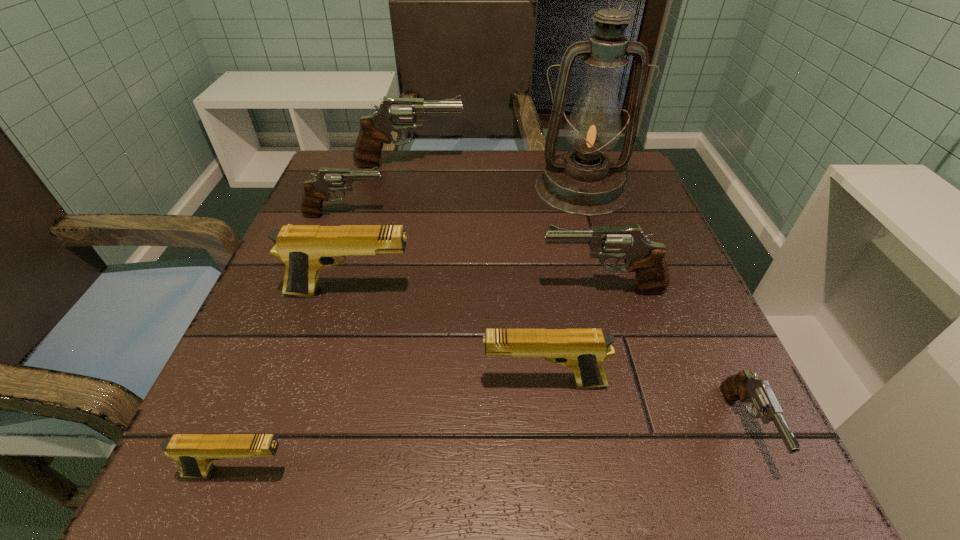
The image size is (960, 540). Find the location of `vacant space located at the barrel of the second biggest tan pistol`. vacant space located at the barrel of the second biggest tan pistol is located at coordinates (272, 383).

Where is `vacant area situated 0.270m at the barrel of the second biggest tan pistol`? vacant area situated 0.270m at the barrel of the second biggest tan pistol is located at coordinates (299, 383).

Image resolution: width=960 pixels, height=540 pixels. In order to click on free space located at the barrel of the second biggest tan pistol in this screenshot , I will do `click(285, 383)`.

The image size is (960, 540). Find the location of `vacant space located at the barrel of the nearest tan pistol`. vacant space located at the barrel of the nearest tan pistol is located at coordinates coord(468,472).

The image size is (960, 540). What are the coordinates of `oil lamp present at the far edge` in the screenshot? It's located at (584, 182).

This screenshot has height=540, width=960. I want to click on pistol that is at the far edge, so click(394, 114).

At what (x,y) coordinates should I click in order to perform the action: click on oil lamp present at the right edge. Please return your answer as a coordinate pair (x, y). Looking at the image, I should click on (x=584, y=182).

Locate an element on the screen. object at the far left corner is located at coordinates (394, 114).

Locate an element on the screen. This screenshot has height=540, width=960. object situated at the near left corner is located at coordinates (195, 453).

You are a GUI agent. You are given a task and a screenshot of the screen. Output one action in this format:
    pyautogui.click(x=<x>, y=<y>)
    Task: Click on the object present at the far right corner
    This screenshot has width=960, height=540.
    Given the screenshot: What is the action you would take?
    pyautogui.click(x=584, y=182)